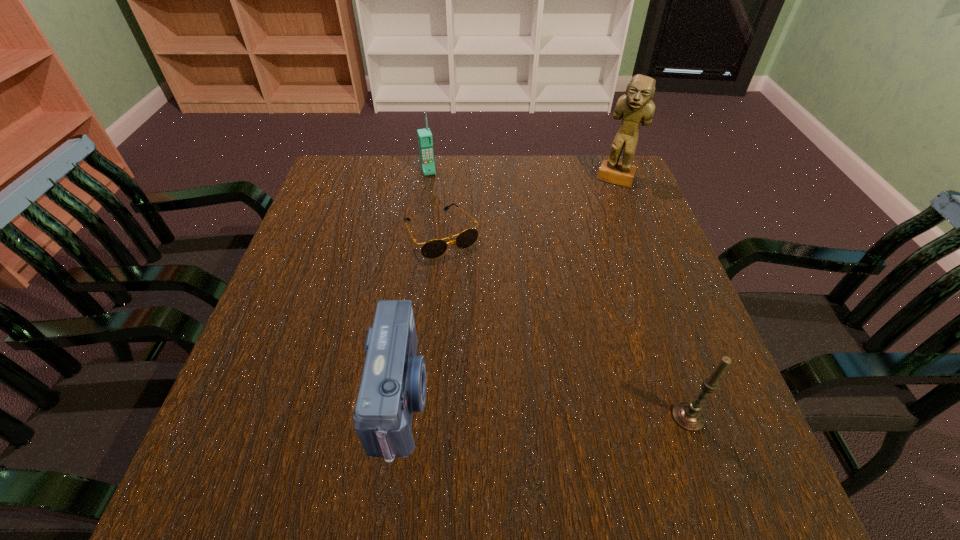
The width and height of the screenshot is (960, 540). Identify the location of vacant point located between the figurine and the fourth tallest object. (508, 288).

Where is `vacant area that lies between the third farthest object and the candle`? vacant area that lies between the third farthest object and the candle is located at coordinates (564, 326).

Select which object appears as the fourth closest to the sunglasses. Please provide its 2D coordinates. Your answer should be formatted as a tuple, i.e. [(x, y)], where the tuple contains the x and y coordinates of a point satisfying the conditions above.

[(688, 415)]

Where is `the second closest object relative to the tallest object`? the second closest object relative to the tallest object is located at coordinates (425, 141).

Where is `vacant space that satisfies the following two spatial constraints: 1. on the back side of the candle; 2. on the left side of the figurine`? vacant space that satisfies the following two spatial constraints: 1. on the back side of the candle; 2. on the left side of the figurine is located at coordinates (605, 179).

Locate an element on the screen. vacant space that satisfies the following two spatial constraints: 1. on the front side of the third nearest object; 2. on the left side of the cellular telephone is located at coordinates (419, 234).